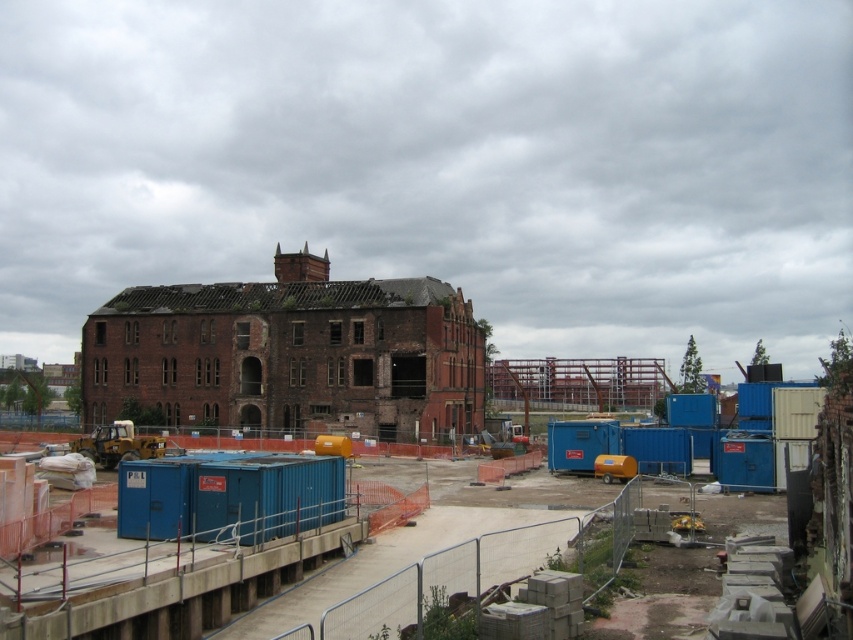
You are a construction worker who needs to place a new temporary structure that must be taller than the blue metallic containers at center but shorter than the red brick building at center. Can you confirm if the structure will fit within the height requirements?

The blue metallic containers at center is shorter than the red brick building at center, so yes, the temporary structure can be placed as long as its height is between the two.

You are a construction worker standing at the entrance of the construction site. You need to locate the blue metallic containers at center. According to the coordinates provided, where exactly should you look to find them?

The blue metallic containers at center are located at the coordinates point [178,563].